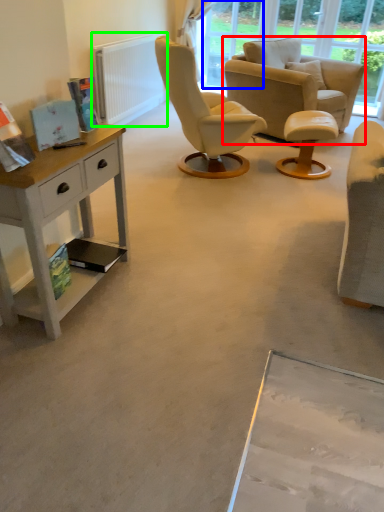
Question: Based on their relative distances, which object is farther from chair (highlighted by a red box)? Choose from window screen (highlighted by a blue box) and radiator (highlighted by a green box).

Choices:
 (A) window screen
 (B) radiator

Answer: (B)